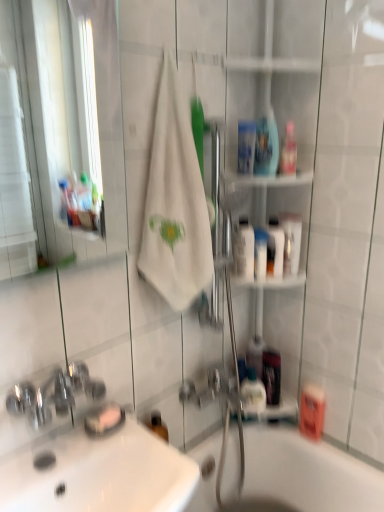
This screenshot has width=384, height=512. Describe the element at coordinates (85, 452) in the screenshot. I see `white glossy sink at lower left` at that location.

Measure the distance between point (310, 403) and camera.

The distance of point (310, 403) from camera is 5.08 feet.

The image size is (384, 512). I want to click on translucent plastic mouthwash at upper right, marked as the fifth mouthwash in a top-to-bottom arrangement, so click(x=275, y=248).

Is white glossy bottle at center-right, arranged as the 6th mouthwash when viewed from the top, closer to camera compared to clear glass mirror at upper left?

No, it is behind clear glass mirror at upper left.

Between white glossy bottle at center-right, arranged as the 6th mouthwash when viewed from the top, and clear glass mirror at upper left, which one has smaller width?

Thinner between the two is clear glass mirror at upper left.

Considering the relative sizes of white glossy bottle at center-right, arranged as the 6th mouthwash when viewed from the top, and clear glass mirror at upper left in the image provided, is white glossy bottle at center-right, arranged as the 6th mouthwash when viewed from the top, smaller than clear glass mirror at upper left?

Yes.

Which of these two, white cotton towel at center or clear glass mirror at upper left, is wider?

white cotton towel at center.

From the picture: Considering the relative positions of white cotton towel at center and clear glass mirror at upper left in the image provided, is white cotton towel at center to the left or to the right of clear glass mirror at upper left?

In the image, white cotton towel at center appears on the right side of clear glass mirror at upper left.

Is white cotton towel at center facing towards clear glass mirror at upper left?

No, white cotton towel at center does not turn towards clear glass mirror at upper left.

Considering the sizes of objects white cotton towel at center and clear glass mirror at upper left in the image provided, who is taller, white cotton towel at center or clear glass mirror at upper left?

With more height is white cotton towel at center.

Between translucent plastic mouthwash at right, which is the eighth mouthwash in top-to-bottom order, and translucent plastic mouthwash at upper right, marked as the fifth mouthwash in a top-to-bottom arrangement, which one has larger size?

translucent plastic mouthwash at right, which is the eighth mouthwash in top-to-bottom order.

Would you say translucent plastic mouthwash at right, which is the eighth mouthwash in top-to-bottom order, is a long distance from translucent plastic mouthwash at upper right, which is counted as the 5th mouthwash, starting from the bottom?

translucent plastic mouthwash at right, which is the eighth mouthwash in top-to-bottom order, is actually quite close to translucent plastic mouthwash at upper right, which is counted as the 5th mouthwash, starting from the bottom.

From a real-world perspective, relative to translucent plastic mouthwash at upper right, marked as the fifth mouthwash in a top-to-bottom arrangement, is translucent plastic mouthwash at right, which is the eighth mouthwash in top-to-bottom order, vertically above or below?

translucent plastic mouthwash at right, which is the eighth mouthwash in top-to-bottom order, is situated lower than translucent plastic mouthwash at upper right, marked as the fifth mouthwash in a top-to-bottom arrangement, in the real world.

Do you think translucent plastic mouthwash at right, which is counted as the second mouthwash, starting from the bottom, is within translucent plastic mouthwash at upper right, which is counted as the 5th mouthwash, starting from the bottom, or outside of it?

translucent plastic mouthwash at right, which is counted as the second mouthwash, starting from the bottom, is outside translucent plastic mouthwash at upper right, which is counted as the 5th mouthwash, starting from the bottom.

What are the coordinates of `the 1st mouthwash to the right of the translucent plastic mouthwash at lower right, acting as the seventh mouthwash starting from the top, starting your count from the anchor` in the screenshot? It's located at (288, 151).

Considering the points (290, 139) and (278, 401), which point is in front, point (290, 139) or point (278, 401)?

The point (290, 139) is closer to the camera.

Is translucent plastic mouthwash at lower right, which appears as the 3th mouthwash when ordered from the bottom, inside pink plastic mouthwash at upper center, which is the second mouthwash in top-to-bottom order?

That's incorrect, translucent plastic mouthwash at lower right, which appears as the 3th mouthwash when ordered from the bottom, is not inside pink plastic mouthwash at upper center, which is the second mouthwash in top-to-bottom order.

From a real-world perspective, is pink plastic mouthwash at upper center, which is the second mouthwash in top-to-bottom order, over translucent plastic mouthwash at lower right, acting as the seventh mouthwash starting from the top?

Indeed, from a real-world perspective, pink plastic mouthwash at upper center, which is the second mouthwash in top-to-bottom order, stands above translucent plastic mouthwash at lower right, acting as the seventh mouthwash starting from the top.

Is the surface of pink plastic mouthwash at upper center, which is the second mouthwash in top-to-bottom order, in direct contact with white glossy sink at lower left?

pink plastic mouthwash at upper center, which is the second mouthwash in top-to-bottom order, and white glossy sink at lower left are clearly separated.

In terms of width, does pink plastic mouthwash at upper center, which is the second mouthwash in top-to-bottom order, look wider or thinner when compared to white glossy sink at lower left?

pink plastic mouthwash at upper center, which is the second mouthwash in top-to-bottom order, is thinner than white glossy sink at lower left.

Measure the distance from pink plastic mouthwash at upper center, which is the second mouthwash in top-to-bottom order, to white glossy sink at lower left.

They are 39.37 inches apart.

Is white glossy sink at lower left completely or partially inside pink plastic mouthwash at upper center, the 8th mouthwash in the bottom-to-top sequence?

No, white glossy sink at lower left is not inside pink plastic mouthwash at upper center, the 8th mouthwash in the bottom-to-top sequence.

Is white glossy bottle at center-right, arranged as the 4th mouthwash when ordered from the bottom, not close to translucent plastic mouthwash at upper right, marked as the fifth mouthwash in a top-to-bottom arrangement?

They are positioned close to each other.

Could you tell me if white glossy bottle at center-right, arranged as the 6th mouthwash when viewed from the top, is turned towards translucent plastic mouthwash at upper right, marked as the fifth mouthwash in a top-to-bottom arrangement?

No, white glossy bottle at center-right, arranged as the 6th mouthwash when viewed from the top, is not turned towards translucent plastic mouthwash at upper right, marked as the fifth mouthwash in a top-to-bottom arrangement.

Is white glossy bottle at center-right, arranged as the 4th mouthwash when ordered from the bottom, to the left of translucent plastic mouthwash at upper right, marked as the fifth mouthwash in a top-to-bottom arrangement, from the viewer's perspective?

Yes.

Consider the image. From the image's perspective, is white glossy bottle at center-right, arranged as the 4th mouthwash when ordered from the bottom, located above or below clear plastic mouthwash at upper center, which is the 3th mouthwash from top to bottom?

Clearly, from the image's perspective, white glossy bottle at center-right, arranged as the 4th mouthwash when ordered from the bottom, is below clear plastic mouthwash at upper center, which is the 3th mouthwash from top to bottom.

In terms of width, does white glossy bottle at center-right, arranged as the 6th mouthwash when viewed from the top, look wider or thinner when compared to clear plastic mouthwash at upper center, which is the 3th mouthwash from top to bottom?

white glossy bottle at center-right, arranged as the 6th mouthwash when viewed from the top, is wider than clear plastic mouthwash at upper center, which is the 3th mouthwash from top to bottom.

I want to click on mouthwash that is the 3rd one when counting downward from the clear plastic mouthwash at upper center, which is the 3th mouthwash from top to bottom (from the image's perspective), so click(244, 249).

From the picture: Is clear plastic mouthwash at upper center, which is the 3th mouthwash from top to bottom, located within white glossy bottle at center-right, arranged as the 6th mouthwash when viewed from the top?

Actually, clear plastic mouthwash at upper center, which is the 3th mouthwash from top to bottom, is outside white glossy bottle at center-right, arranged as the 6th mouthwash when viewed from the top.

The height and width of the screenshot is (512, 384). I want to click on mirror in front of the white glossy bottle at center-right, arranged as the 4th mouthwash when ordered from the bottom, so click(x=68, y=113).

This screenshot has height=512, width=384. I want to click on mirror located on the left of white cotton towel at center, so click(x=68, y=113).

In the scene shown: Considering their positions, is white cotton towel at center positioned closer to white glossy sink at lower left than translucent plastic mouthwash at upper right, marked as the fifth mouthwash in a top-to-bottom arrangement?

Among the two, white cotton towel at center is located nearer to white glossy sink at lower left.

Based on their spatial positions, is white glossy mouthwash at upper right, the sixth mouthwash positioned from the bottom, or white glossy sink at lower left further from pink matte mouthwash at lower right, the 9th mouthwash in the top-to-bottom sequence?

white glossy sink at lower left is positioned further to the anchor pink matte mouthwash at lower right, the 9th mouthwash in the top-to-bottom sequence.

In the scene shown: Looking at the image, which one is located further to white glossy mouthwash at upper right, the sixth mouthwash positioned from the bottom, translucent plastic mouthwash at upper right, marked as the fifth mouthwash in a top-to-bottom arrangement, or pink matte mouthwash at lower right, positioned as the first mouthwash in bottom-to-top order?

Based on the image, pink matte mouthwash at lower right, positioned as the first mouthwash in bottom-to-top order, appears to be further to white glossy mouthwash at upper right, the sixth mouthwash positioned from the bottom.

Looking at the image, which one is located further to clear glass mirror at upper left, pink plastic mouthwash at upper center, the 8th mouthwash in the bottom-to-top sequence, or white glossy sink at lower left?

pink plastic mouthwash at upper center, the 8th mouthwash in the bottom-to-top sequence, is further to clear glass mirror at upper left.

Considering their positions, is translucent plastic mouthwash at lower right, acting as the seventh mouthwash starting from the top, positioned further to translucent plastic mouthwash at right, which is the eighth mouthwash in top-to-bottom order, than clear plastic mouthwash at upper center, placed as the 7th mouthwash when sorted from bottom to top?

clear plastic mouthwash at upper center, placed as the 7th mouthwash when sorted from bottom to top, lies further to translucent plastic mouthwash at right, which is the eighth mouthwash in top-to-bottom order, than the other object.

Considering their positions, is white cotton towel at center positioned further to clear plastic mouthwash at upper center, which is the 3th mouthwash from top to bottom, than white glossy sink at lower left?

white glossy sink at lower left.

Which object lies nearer to the anchor point translucent plastic mouthwash at upper right, which is counted as the 5th mouthwash, starting from the bottom, clear glass mirror at upper left or white glossy sink at lower left?

white glossy sink at lower left.

Based on their spatial positions, is translucent plastic mouthwash at right, which is counted as the second mouthwash, starting from the bottom, or translucent plastic mouthwash at lower right, which appears as the 3th mouthwash when ordered from the bottom, further from pink plastic mouthwash at upper center, the 8th mouthwash in the bottom-to-top sequence?

Based on the image, translucent plastic mouthwash at right, which is counted as the second mouthwash, starting from the bottom, appears to be further to pink plastic mouthwash at upper center, the 8th mouthwash in the bottom-to-top sequence.

Locate an element on the screen. The width and height of the screenshot is (384, 512). bath towel between clear glass mirror at upper left and translucent plastic mouthwash at right, which is counted as the second mouthwash, starting from the bottom, vertically is located at coordinates (175, 203).

This screenshot has height=512, width=384. I want to click on mirror that lies between pink plastic mouthwash at upper center, the 8th mouthwash in the bottom-to-top sequence, and pink matte mouthwash at lower right, the 9th mouthwash in the top-to-bottom sequence, from top to bottom, so click(x=68, y=113).

At what (x,y) coordinates should I click in order to perform the action: click on mirror between pink plastic mouthwash at upper center, which is the second mouthwash in top-to-bottom order, and translucent plastic mouthwash at right, which is the eighth mouthwash in top-to-bottom order, in the up-down direction. Please return your answer as a coordinate pair (x, y). This screenshot has width=384, height=512. Looking at the image, I should click on (68, 113).

This screenshot has height=512, width=384. I want to click on sink between clear plastic mouthwash at upper center, which is the 3th mouthwash from top to bottom, and pink matte mouthwash at lower right, the 9th mouthwash in the top-to-bottom sequence, in the vertical direction, so (85, 452).